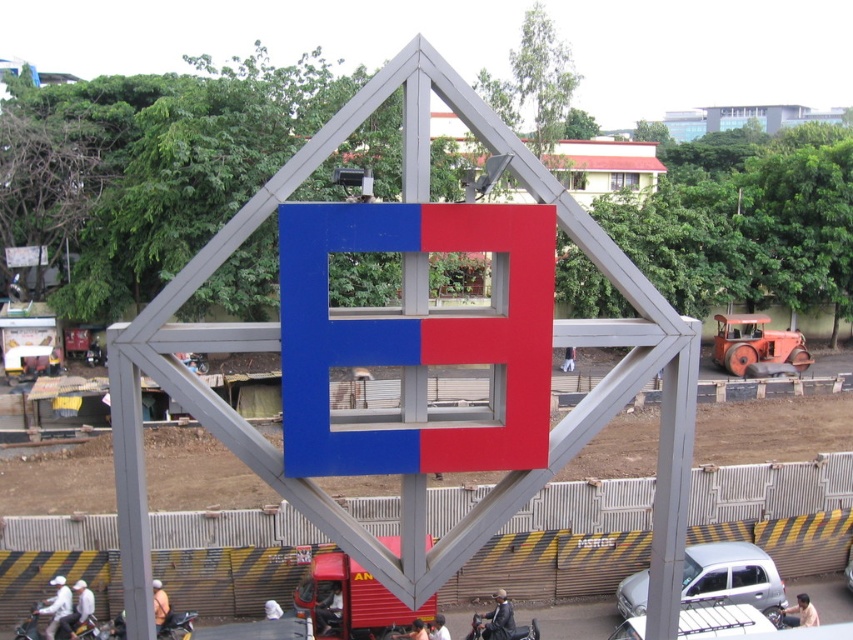
Question: Among these objects, which one is farthest from the camera?

Choices:
 (A) silver metallic hatchback at center
 (B) blue matte sign at center
 (C) black matte motorcycle at lower center

Answer: (A)

Question: Is silver metallic hatchback at center in front of black matte motorcycle at lower center?

Choices:
 (A) no
 (B) yes

Answer: (A)

Question: Which point is farther to the camera?

Choices:
 (A) blue matte sign at center
 (B) black matte motorcycle at lower center

Answer: (B)

Question: Which of these objects is positioned closest to the white matte car at lower right?

Choices:
 (A) silver metallic hatchback at center
 (B) blue matte sign at center
 (C) black matte motorcycle at lower center

Answer: (A)

Question: Is blue matte sign at center to the left of white matte car at lower right from the viewer's perspective?

Choices:
 (A) no
 (B) yes

Answer: (B)

Question: Can you confirm if blue matte sign at center is positioned above black matte motorcycle at lower center?

Choices:
 (A) yes
 (B) no

Answer: (A)